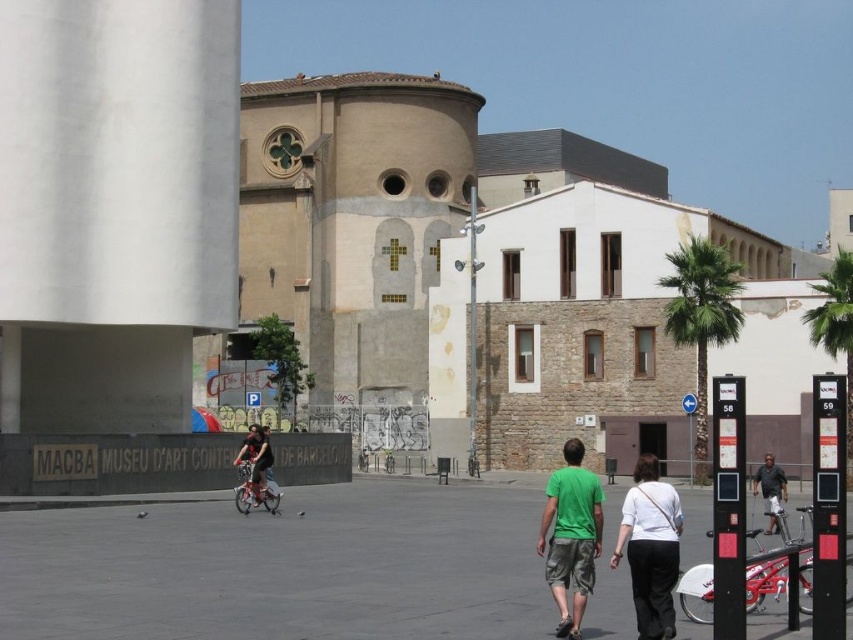
You are a photographer standing in the urban scene described. You want to capture a photo of the MACBA building in the background while ensuring the red bicycle in the foreground is also visible. However, there is a person wearing a green matte t shirt at center. Where should you position yourself so that the point at coordinate (572, 536) on the green matte t shirt at center does not block your view of the MACBA building?

To avoid blocking the MACBA building with the green matte t shirt at center, position yourself such that the point at coordinate (572, 536) on the green matte t shirt at center is outside your camera frame or adjust your angle so that this point does not overlap with the MACBA building in the background.

You are planning to park your bicycle in the space where the dark gray shirt at center is currently standing. Based on the scene, will the matte black bicycle at center fit in that space?

The matte black bicycle at center is wider than the dark gray shirt at center, so it may not fit in the space where the dark gray shirt is standing.